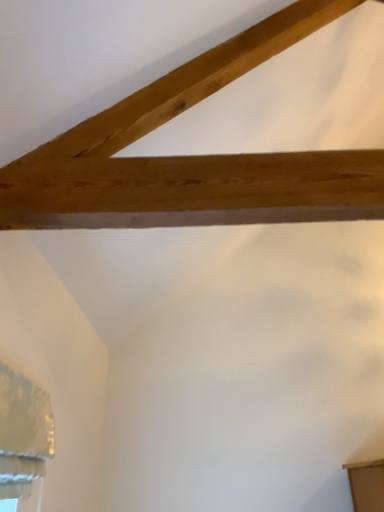
Measure the distance between point (44, 454) and camera.

Point (44, 454) is 4.36 feet from camera.

Describe the element at coordinates (23, 434) in the screenshot. Image resolution: width=384 pixels, height=512 pixels. I see `metallic silver bay window at lower left` at that location.

This screenshot has width=384, height=512. I want to click on metallic silver bay window at lower left, so click(x=23, y=434).

The image size is (384, 512). Find the location of `metallic silver bay window at lower left`. metallic silver bay window at lower left is located at coordinates (23, 434).